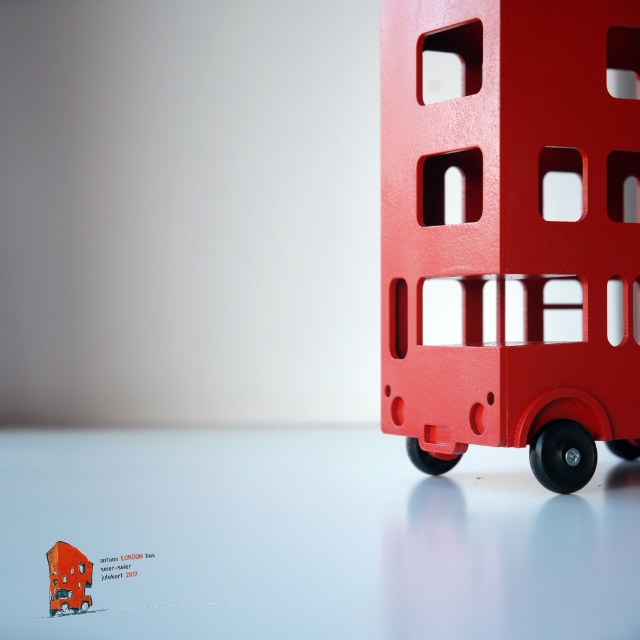
You are holding a measuring tape and need to determine the distance between the point at coordinates (508, 348) and the camera position. According to the image description, what is this distance?

The distance between the point at coordinates (508, 348) and the camera position is 3.29 feet.

You are setting up a display for a toy store and need to place the matte plastic bus at right and the matte red bus at center. The store requires that the distance between the two buses must be exactly 75 centimeters. Can you adjust their positions to meet this requirement?

The current distance between the matte plastic bus at right and the matte red bus at center is 74.01 centimeters. To meet the store requirement of 75 centimeters, you need to increase the distance between them by approximately 0.99 centimeters.

You are setting up a display for a toy store and need to arrange the matte plastic bus at right and the matte red bus at center. According to the image, which bus is placed on top of the other?

The matte plastic bus at right is positioned over the matte red bus at center, so it is placed on top.